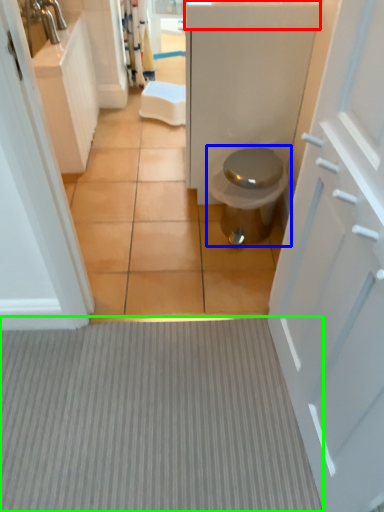
Question: Which is nearer to the counter top (highlighted by a red box)? toilet (highlighted by a blue box) or plain (highlighted by a green box).

Choices:
 (A) toilet
 (B) plain

Answer: (A)